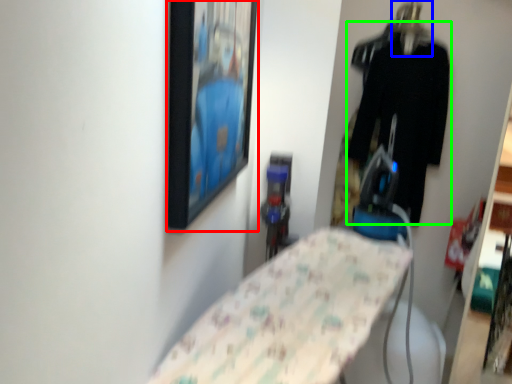
Question: Considering the real-world distances, which object is closest to picture frame (highlighted by a red box)? hanger (highlighted by a blue box) or clothing (highlighted by a green box).

Choices:
 (A) hanger
 (B) clothing

Answer: (B)